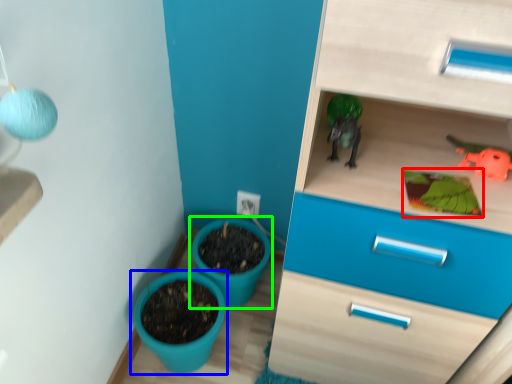
Question: Based on their relative distances, which object is farther from plant (highlighted by a red box)? Choose from flowerpot (highlighted by a blue box) and flowerpot (highlighted by a green box).

Choices:
 (A) flowerpot
 (B) flowerpot

Answer: (A)